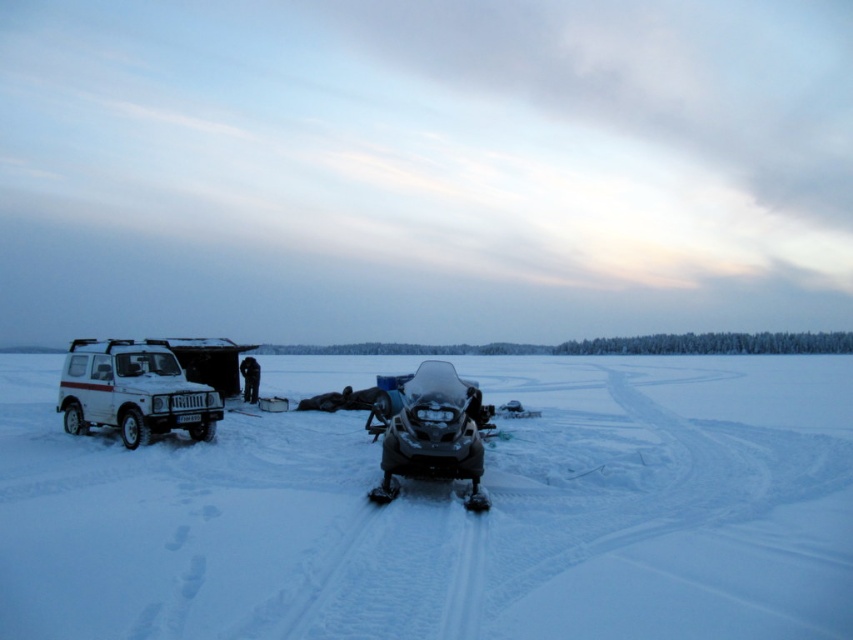
In the scene shown: Is white matte jeep at left thinner than shiny black snowmobile at center?

No.

Image resolution: width=853 pixels, height=640 pixels. I want to click on white matte jeep at left, so click(x=132, y=392).

You are a GUI agent. You are given a task and a screenshot of the screen. Output one action in this format:
    pyautogui.click(x=<x>, y=<y>)
    Task: Click on the white matte jeep at left
    The height and width of the screenshot is (640, 853).
    Given the screenshot: What is the action you would take?
    pyautogui.click(x=132, y=392)

The height and width of the screenshot is (640, 853). I want to click on white matte snow at center, so click(x=450, y=515).

Is white matte snow at center closer to camera compared to white matte jeep at left?

That is True.

I want to click on white matte snow at center, so click(450, 515).

Where is `white matte snow at center`? white matte snow at center is located at coordinates (450, 515).

How much distance is there between white matte snow at center and shiny black snowmobile at center?

A distance of 9.49 meters exists between white matte snow at center and shiny black snowmobile at center.

This screenshot has height=640, width=853. What are the coordinates of `white matte snow at center` in the screenshot? It's located at (450, 515).